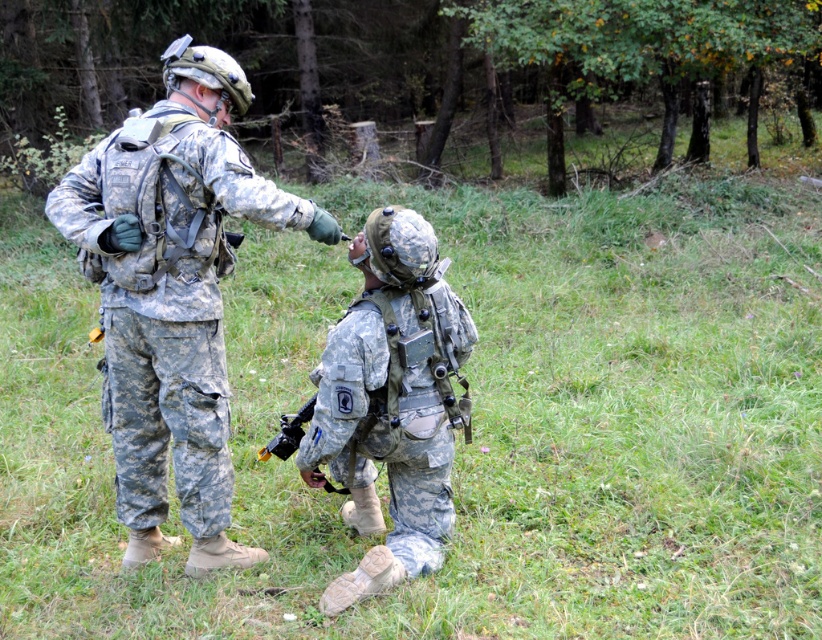
Based on the coordinates provided, can you identify which object in the scene corresponds to the point location of point [172,294]?

The camouflage fabric uniform at center corresponds to the point location of point [172,294].

You are a photographer trying to capture a clear photo of the matte black rifle at center. The camouflage fabric uniform at center is blocking your view. Can you estimate if the rifle will fit in the frame if you move the uniform to the side?

The camouflage fabric uniform at center is wider than the matte black rifle at center, so moving the uniform to the side would allow the rifle to fit within the frame since it is narrower.